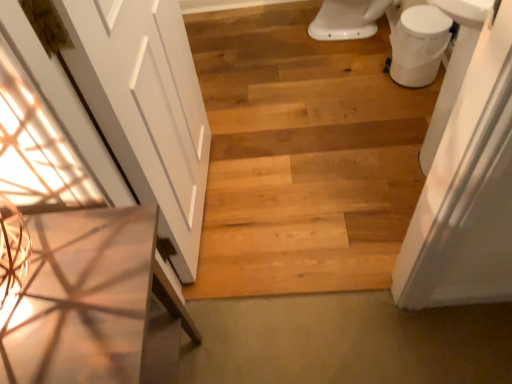
You are a GUI agent. You are given a task and a screenshot of the screen. Output one action in this format:
    pyautogui.click(x=<x>, y=<y>)
    Task: Click on the vacant space behind white matte door at left
    
    Given the screenshot: What is the action you would take?
    245,127